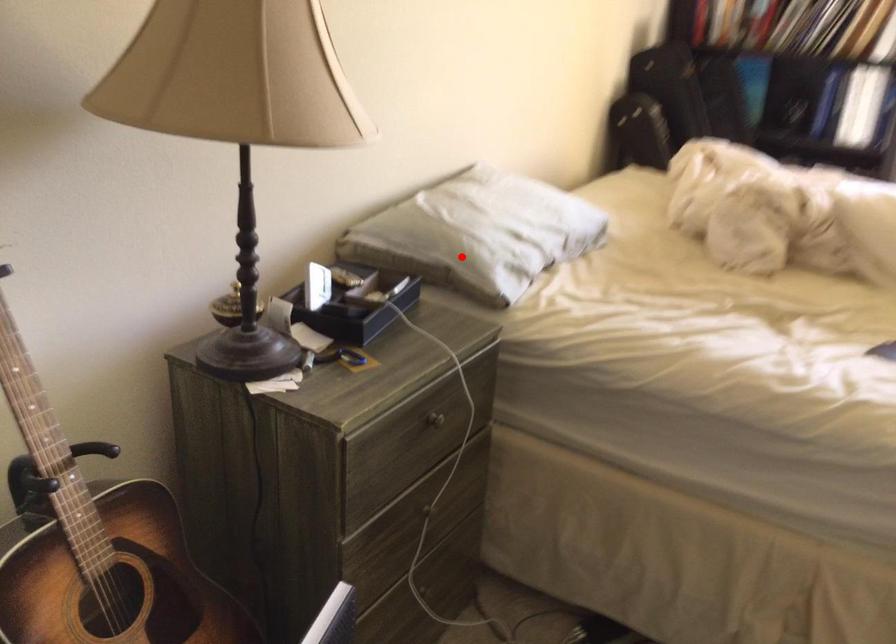
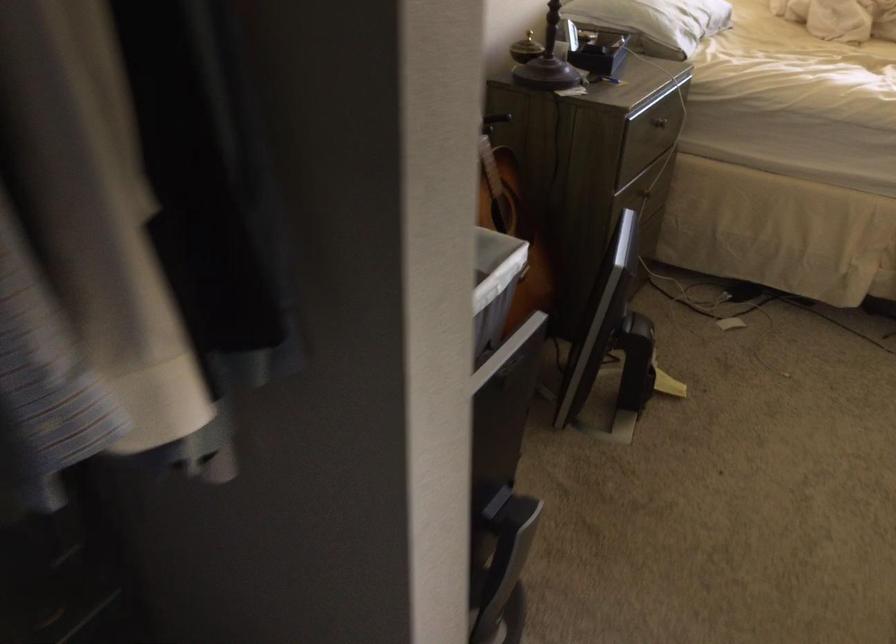
Where in the second image is the point corresponding to the highlighted location from the first image?

(655, 21)